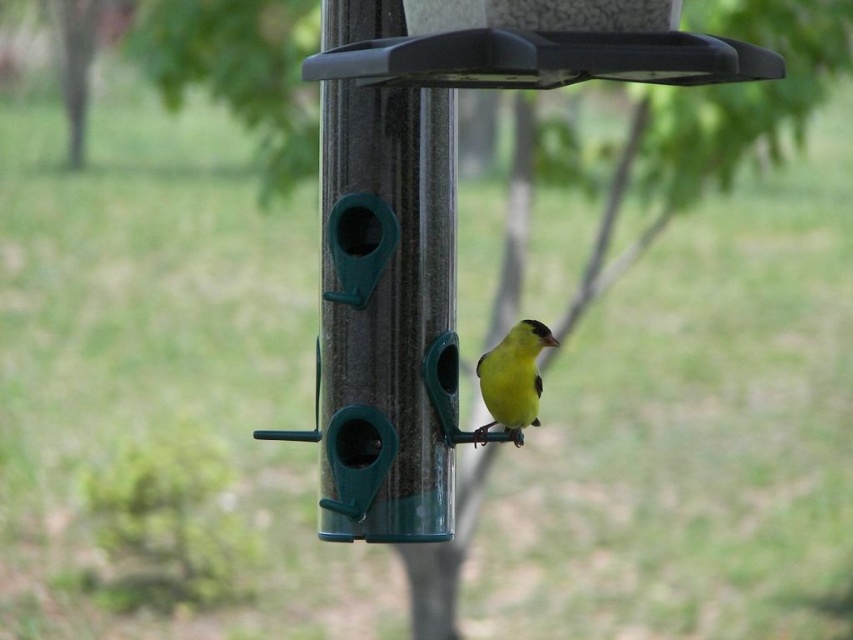
Can you confirm if transparent plastic pole at center is positioned above yellow matte bird at center?

Indeed, transparent plastic pole at center is positioned over yellow matte bird at center.

Who is more forward, (x=426, y=243) or (x=490, y=378)?

Point (x=426, y=243) is more forward.

Locate an element on the screen. transparent plastic pole at center is located at coordinates click(383, 282).